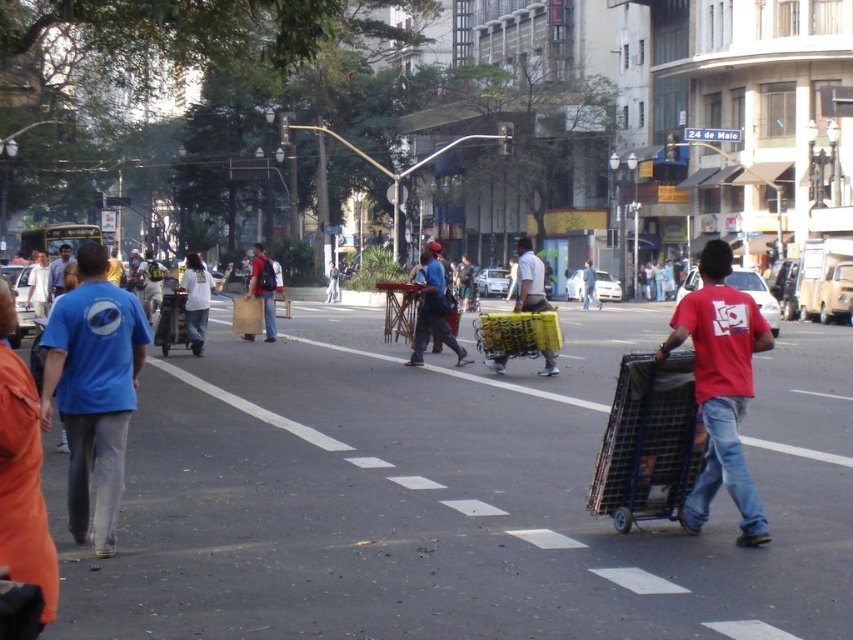
You are standing at the point with coordinates (x=433, y=308) in the urban street scene. What object is exactly at your location?

The red fabric bag at center is located at point (x=433, y=308).

You are standing on the street and want to take a photo of both the point at coordinate (x=415, y=344) and the point at coordinate (x=517, y=308). Which point will appear closer to the bottom of the photo?

Point (x=517, y=308) will appear closer to the bottom of the photo because it is further away from the camera compared to point (x=415, y=344).

Based on the photo, you are a delivery person needing to cross the street. There is a metallic blue trolley at right and a matte yellow cart at center. Which cart is closer to the left side of the street?

The metallic blue trolley at right is to the left of the matte yellow cart at center, so the metallic blue trolley at right is closer to the left side of the street.